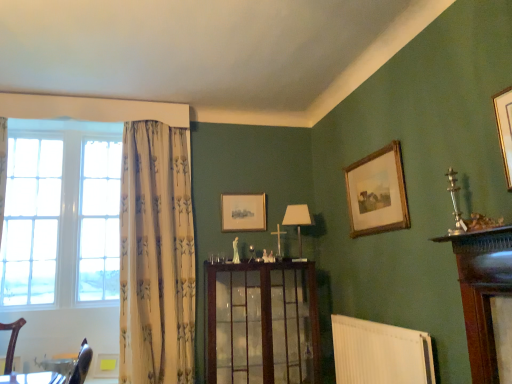
Question: Would you say white floral fabric curtain at left is inside or outside white fabric lampshade at center?

Choices:
 (A) outside
 (B) inside

Answer: (A)

Question: Does point (162, 364) appear closer or farther from the camera than point (285, 225)?

Choices:
 (A) closer
 (B) farther

Answer: (A)

Question: Estimate the real-world distances between objects in this image. Which object is farther from the wooden cabinet at center?

Choices:
 (A) matte wooden picture frame at center, the 1th picture frame positioned from the back
 (B) wooden picture frame at upper right, the 2th picture frame from the back
 (C) white glass window at left
 (D) white ribbed radiator at lower center
 (E) white fabric lampshade at center

Answer: (C)

Question: Which is farther from the white floral fabric curtain at left?

Choices:
 (A) wooden picture frame at upper right, the 2th picture frame from the back
 (B) white glass window at left
 (C) matte wooden picture frame at center, which is counted as the second picture frame, starting from the right
 (D) white fabric lampshade at center
 (E) wooden cabinet at center

Answer: (A)